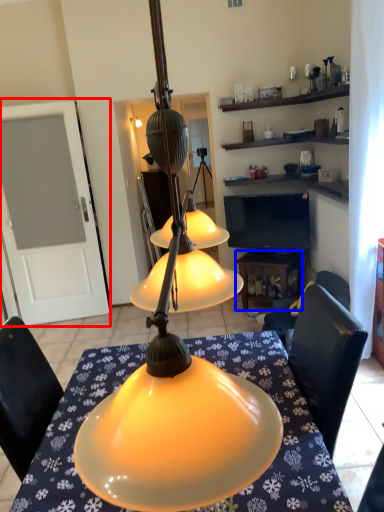
Question: Which of the following is the farthest to the observer, glass door (highlighted by a red box) or table (highlighted by a blue box)?

Choices:
 (A) glass door
 (B) table

Answer: (B)